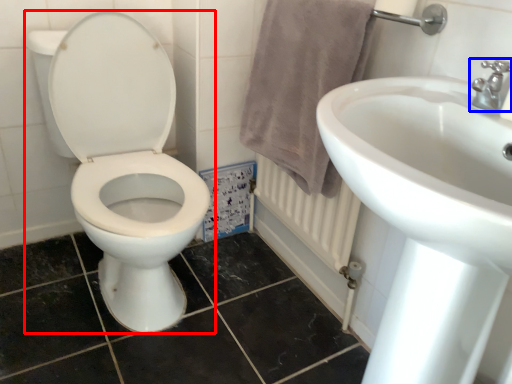
Question: Which point is further to the camera, toilet (highlighted by a red box) or tap (highlighted by a blue box)?

Choices:
 (A) toilet
 (B) tap

Answer: (A)